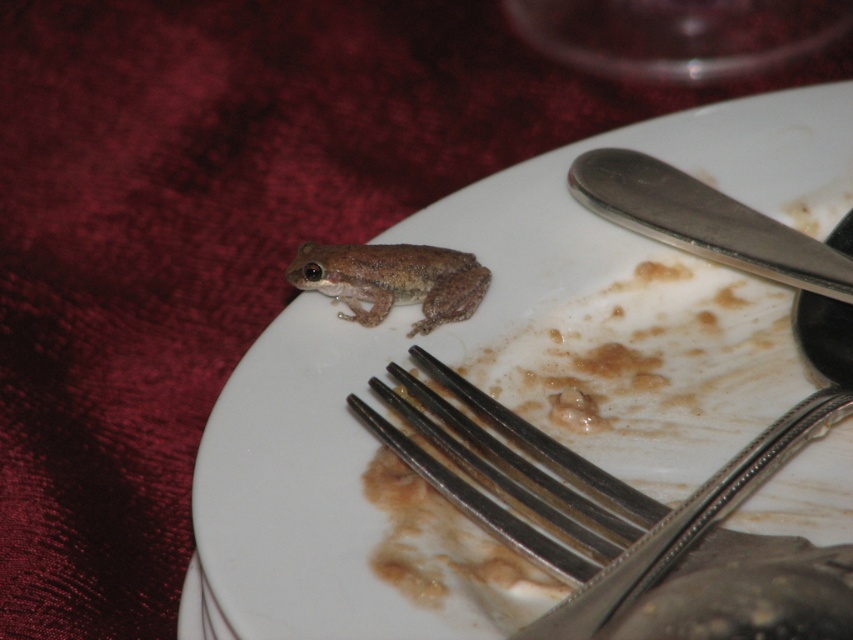
Can you confirm if silver metallic fork at lower center is positioned to the left of silver metallic knife at upper right?

Yes, silver metallic fork at lower center is to the left of silver metallic knife at upper right.

How much distance is there between silver metallic fork at lower center and silver metallic knife at upper right?

13.64 inches

Is point (467, 492) farther from camera compared to point (787, 237)?

No, (467, 492) is closer to viewer.

I want to click on silver metallic fork at lower center, so click(x=622, y=520).

Between silver metallic fork at lower center and brown matte/fuzzy frog at center, which one appears on the right side from the viewer's perspective?

silver metallic fork at lower center is more to the right.

Does silver metallic fork at lower center have a smaller size compared to brown matte/fuzzy frog at center?

Actually, silver metallic fork at lower center might be larger than brown matte/fuzzy frog at center.

Locate an element on the screen. silver metallic fork at lower center is located at coordinates (622, 520).

Is the position of white porcelain plate at upper left more distant than that of silver metallic knife at upper right?

No.

Is white porcelain plate at upper left positioned before silver metallic knife at upper right?

Yes.

Measure the distance between point (514,406) and camera.

1.33 meters

Find the location of `white porcelain plate at upper left`. white porcelain plate at upper left is located at coordinates (506, 380).